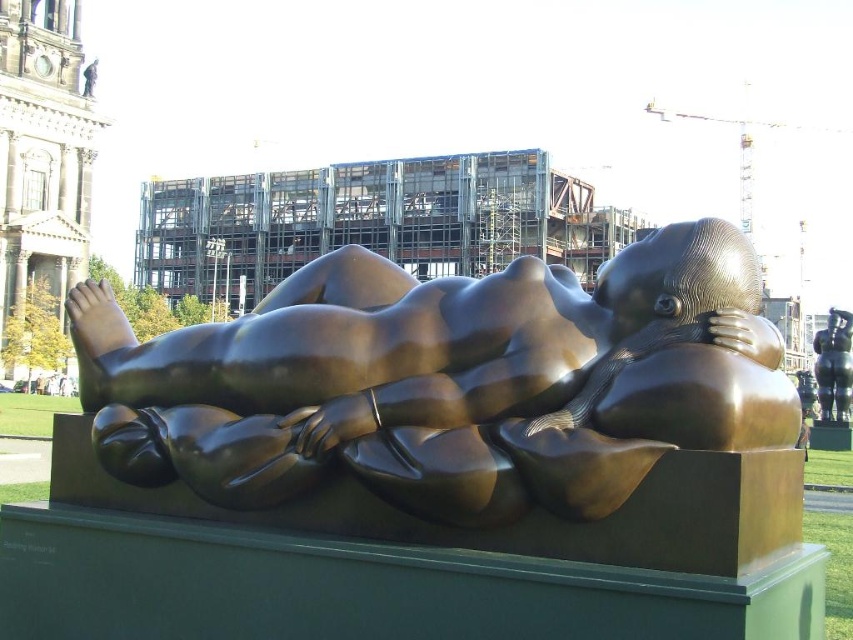
You are an art student standing in front of the bronze sculpture at center and the bronze figure at center. You notice that one is positioned higher than the other. Which one is higher?

The bronze sculpture at center is higher than the bronze figure at center according to the description provided.

Consider the image. You are an art student analyzing the outdoor sculpture garden. You notice the bronze sculpture at center and the bronze figure at center. Which one has a greater height?

The bronze figure at center is taller than the bronze sculpture at center.

You are an art student who wants to sketch the bronze sculpture at center and the bronze figure at center. You notice that one of them is bigger. Which one is larger?

The bronze sculpture at center is larger in size than the bronze figure at center.